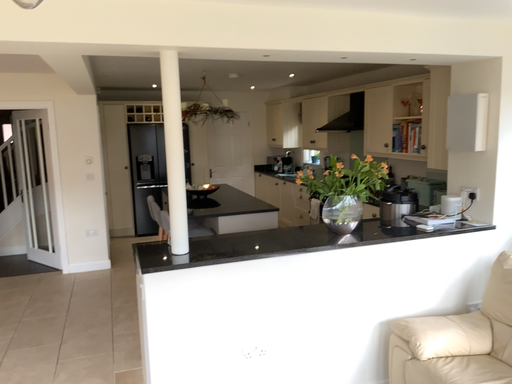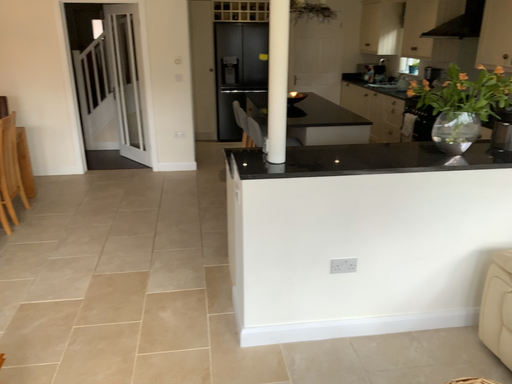
Question: How did the camera likely rotate when shooting the video?

Choices:
 (A) rotated right
 (B) rotated left

Answer: (B)